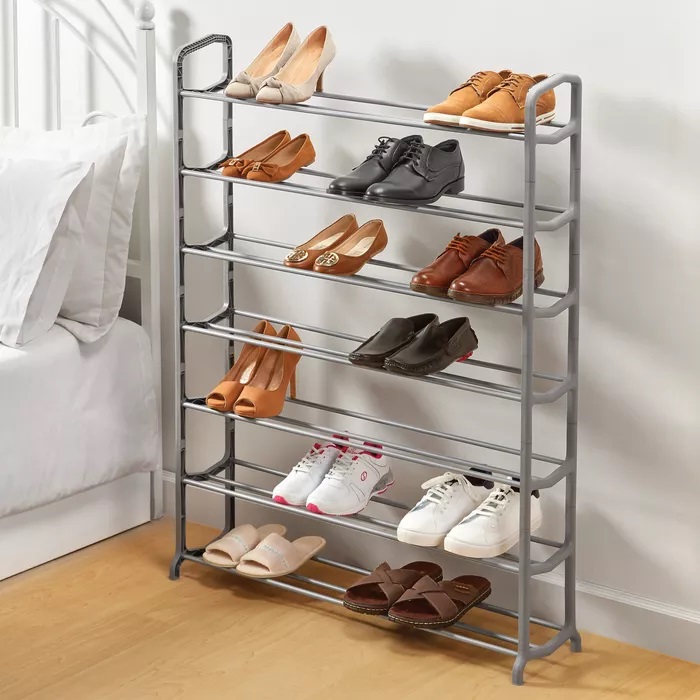
Identify the location of shoe on third shelf down. The image size is (700, 700). (472, 290), (427, 280), (344, 267), (295, 257).